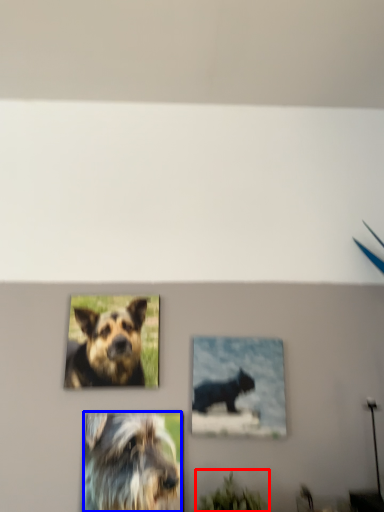
Question: Which object is further to the camera taking this photo, plant (highlighted by a red box) or dog (highlighted by a blue box)?

Choices:
 (A) plant
 (B) dog

Answer: (B)